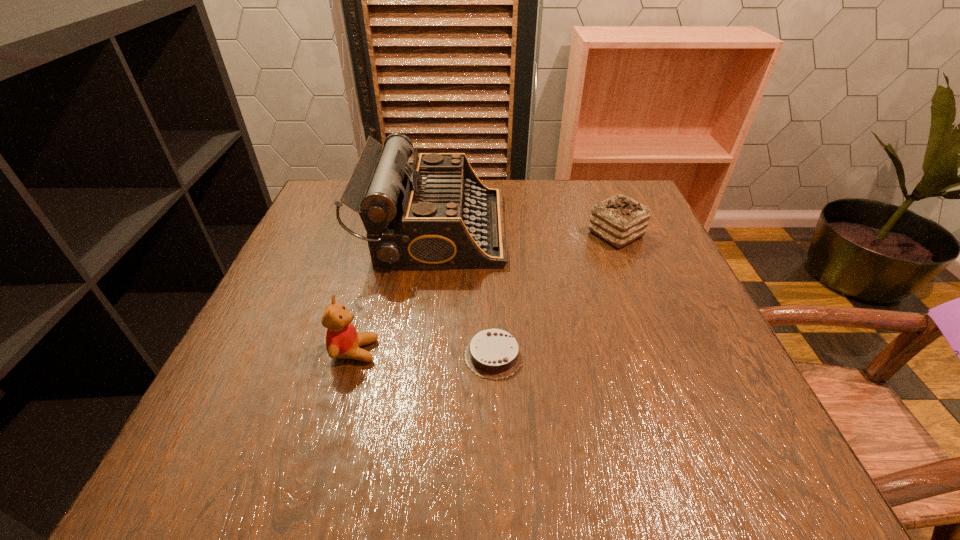
You are a GUI agent. You are given a task and a screenshot of the screen. Output one action in this format:
    pyautogui.click(x=<x>, y=<y>)
    Task: Click on the tallest object
    The image size is (960, 540).
    Given the screenshot: What is the action you would take?
    pyautogui.click(x=434, y=214)

Locate an element on the screen. The width and height of the screenshot is (960, 540). teddy bear is located at coordinates (342, 340).

The image size is (960, 540). I want to click on the second shortest object, so click(619, 220).

Where is `the rightmost object`? the rightmost object is located at coordinates (619, 220).

Where is `the shortest object`? This screenshot has width=960, height=540. the shortest object is located at coordinates (495, 354).

Find the location of `the shorter chocolate cake`. the shorter chocolate cake is located at coordinates coord(495,354).

The width and height of the screenshot is (960, 540). In order to click on vacant space situated on the keyboard of the typewriter in this screenshot , I will do point(562,228).

This screenshot has height=540, width=960. What are the coordinates of `vacant space located on the front-facing side of the third shortest object` in the screenshot? It's located at (562, 351).

This screenshot has width=960, height=540. I want to click on free region located on the left of the taller chocolate cake, so click(x=517, y=234).

Identify the location of vacant region located 0.080m on the front of the nearer chocolate cake. (495, 423).